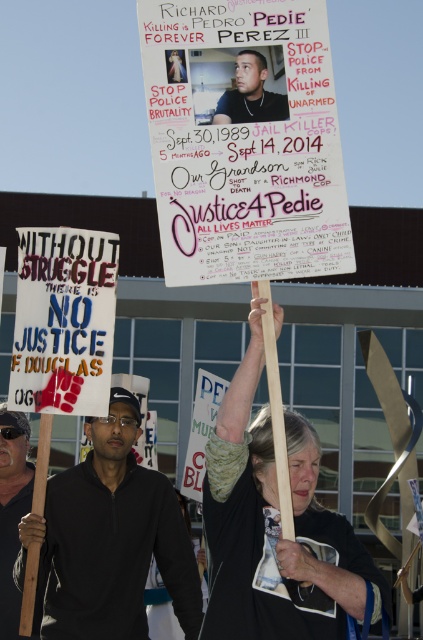
You are a photographer trying to capture the protest scene. You want to focus on the white paper poster at center. Based on its coordinates, where should you aim your camera?

The white paper poster at center is located at point (244,140), so you should aim your camera at those coordinates to capture it.

You are standing in the protest scene and want to move from point A at point [307,54] to point B at point [24,260]. Which direction should you move to get closer to the protesters holding signs in the foreground?

You should move towards point B at point [24,260] because it is further away from the viewer compared to point A at point [307,54], which is closer. Since the protesters are in the foreground, moving towards point B would take you closer to them.

You are a photographer trying to capture both the white paper poster at center and the matte black sign at lower left in a single frame. Given that your camera has a focal length of 50mm and the minimum distance between objects in the frame must be at least 3 meters, will you be able to include both in the shot?

The distance between the white paper poster at center and the matte black sign at lower left is 4.39 meters, which is greater than the minimum required 3 meters. Therefore, you can include both in the shot as the separation meets the requirement.